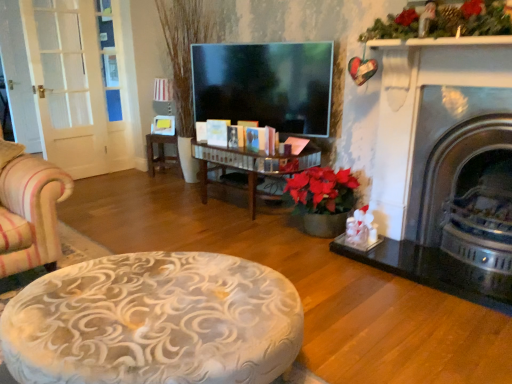
Identify the location of vacant space to the left of shiny silver fireplace at right. The width and height of the screenshot is (512, 384). (382, 275).